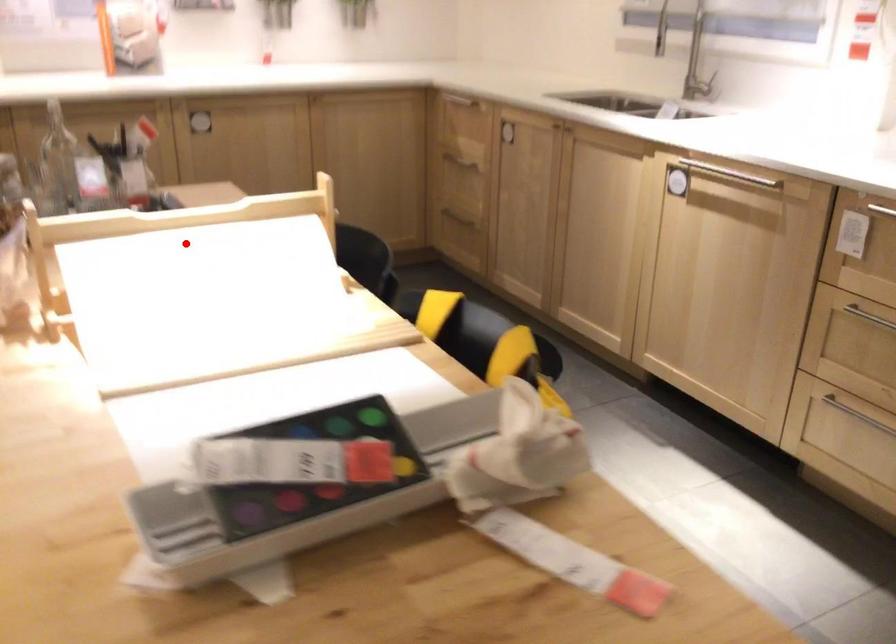
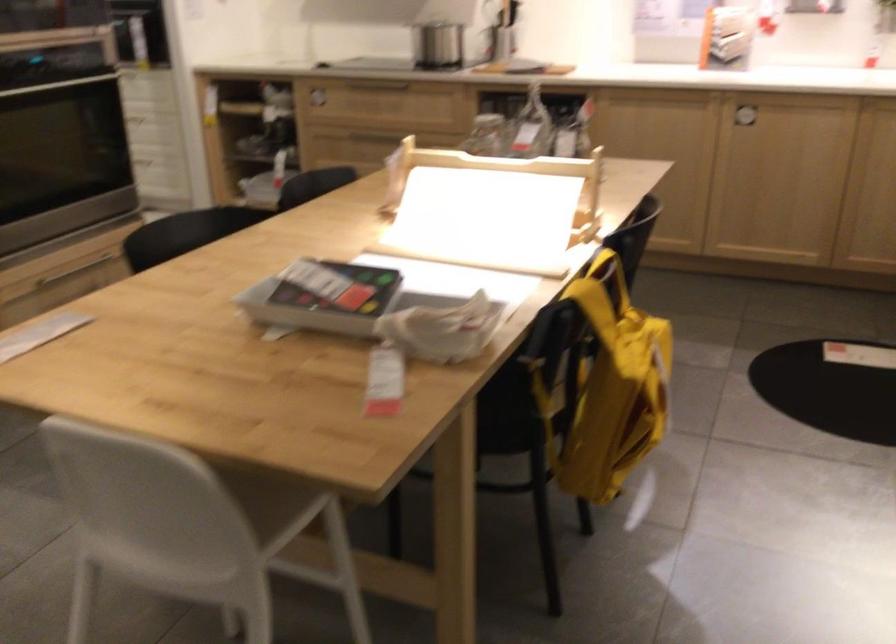
Question: I am providing you with two images of the same scene from different viewpoints. A red point is marked on the first image. Can you still see the location of the red point in image 2?

Choices:
 (A) Yes
 (B) No

Answer: (A)